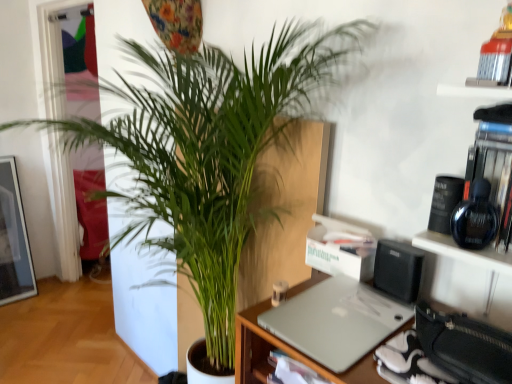
Question: Should I look upward or downward to see green leafy plant at center?

Choices:
 (A) up
 (B) down

Answer: (B)

Question: From the image's perspective, is silver metallic laptop at center located beneath green leafy plant at center?

Choices:
 (A) yes
 (B) no

Answer: (A)

Question: Is silver metallic laptop at center further to the viewer compared to green leafy plant at center?

Choices:
 (A) yes
 (B) no

Answer: (A)

Question: Is silver metallic laptop at center taller than green leafy plant at center?

Choices:
 (A) no
 (B) yes

Answer: (A)

Question: Could you tell me if silver metallic laptop at center is turned towards green leafy plant at center?

Choices:
 (A) no
 (B) yes

Answer: (A)

Question: Is silver metallic laptop at center not inside green leafy plant at center?

Choices:
 (A) yes
 (B) no

Answer: (B)

Question: From a real-world perspective, is silver metallic laptop at center on top of green leafy plant at center?

Choices:
 (A) yes
 (B) no

Answer: (A)

Question: Is green leafy plant at center positioned beyond the bounds of silver metallic laptop at center?

Choices:
 (A) no
 (B) yes

Answer: (B)

Question: Considering the relative sizes of green leafy plant at center and silver metallic laptop at center in the image provided, is green leafy plant at center taller than silver metallic laptop at center?

Choices:
 (A) yes
 (B) no

Answer: (A)

Question: Is green leafy plant at center positioned behind silver metallic laptop at center?

Choices:
 (A) no
 (B) yes

Answer: (A)

Question: Is green leafy plant at center facing towards silver metallic laptop at center?

Choices:
 (A) yes
 (B) no

Answer: (B)

Question: Can you confirm if green leafy plant at center is wider than silver metallic laptop at center?

Choices:
 (A) no
 (B) yes

Answer: (B)

Question: Can you confirm if green leafy plant at center is smaller than silver metallic laptop at center?

Choices:
 (A) yes
 (B) no

Answer: (B)

Question: Considering their positions, is green leafy plant at center located in front of or behind silver metallic laptop at center?

Choices:
 (A) front
 (B) behind

Answer: (A)